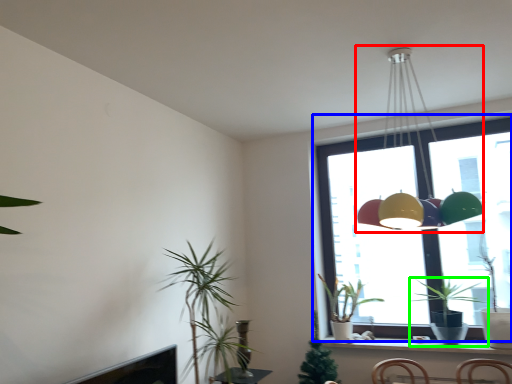
Question: Which object is the farthest from lamp (highlighted by a red box)? Choose among these: window (highlighted by a blue box) or houseplant (highlighted by a green box).

Choices:
 (A) window
 (B) houseplant

Answer: (B)